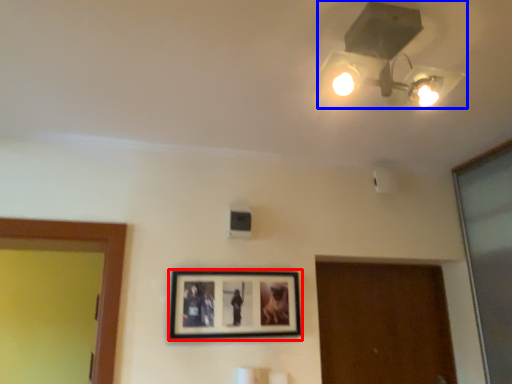
Question: Which object is further to the camera taking this photo, picture frame (highlighted by a red box) or lamp (highlighted by a blue box)?

Choices:
 (A) picture frame
 (B) lamp

Answer: (A)